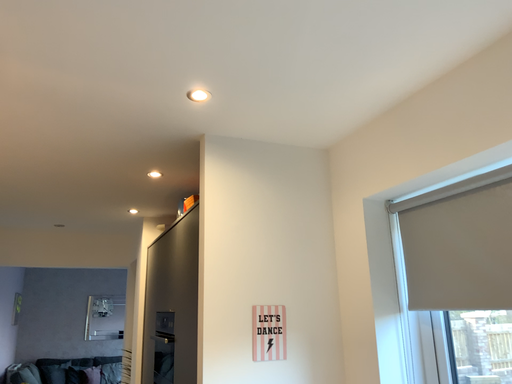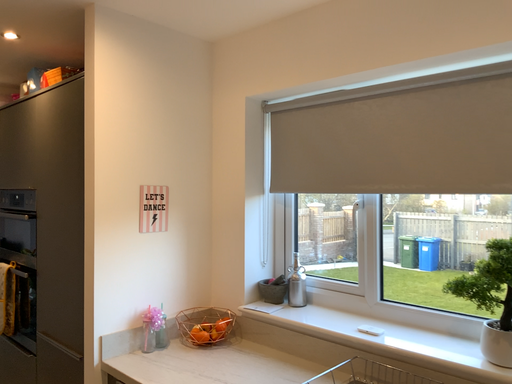
Question: Which way did the camera rotate in the video?

Choices:
 (A) rotated downward
 (B) rotated upward

Answer: (A)